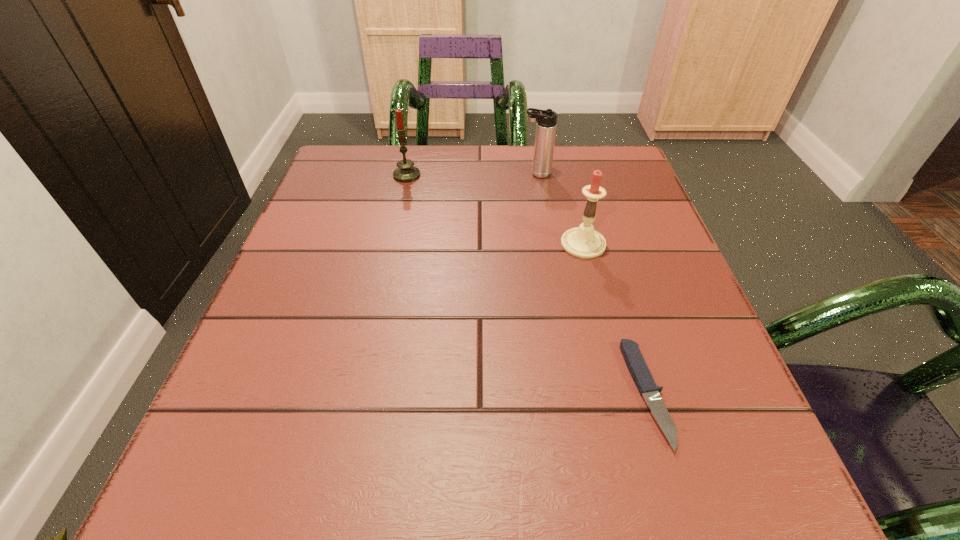
At what (x,y) coordinates should I click in order to perform the action: click on the farther candle. Please return your answer as a coordinate pair (x, y). Looking at the image, I should click on (406, 172).

The image size is (960, 540). Identify the location of the leftmost object. (406, 172).

Image resolution: width=960 pixels, height=540 pixels. Identify the location of the nearer candle. (583, 242).

You are a GUI agent. You are given a task and a screenshot of the screen. Output one action in this format:
    pyautogui.click(x=<x>, y=<y>)
    Task: Click on the right candle
    
    Given the screenshot: What is the action you would take?
    pyautogui.click(x=583, y=242)

Identify the location of thermos bottle. The height and width of the screenshot is (540, 960). (546, 125).

At what (x,y) coordinates should I click in order to perform the action: click on the nearest object. Please return your answer as a coordinate pair (x, y). This screenshot has height=540, width=960. Looking at the image, I should click on (635, 362).

At what (x,y) coordinates should I click in order to perform the action: click on steak knife. Please return your answer as a coordinate pair (x, y). Image resolution: width=960 pixels, height=540 pixels. Looking at the image, I should click on (635, 362).

In order to click on free spot located on the right of the left candle in this screenshot , I will do `click(543, 176)`.

You are a GUI agent. You are given a task and a screenshot of the screen. Output one action in this format:
    pyautogui.click(x=<x>, y=<y>)
    Task: Click on the blank space located 0.180m on the back of the third farthest object
    
    Given the screenshot: What is the action you would take?
    pyautogui.click(x=567, y=183)

This screenshot has height=540, width=960. I want to click on vacant space located 0.300m on the handle side of the thermos bottle, so click(x=399, y=174).